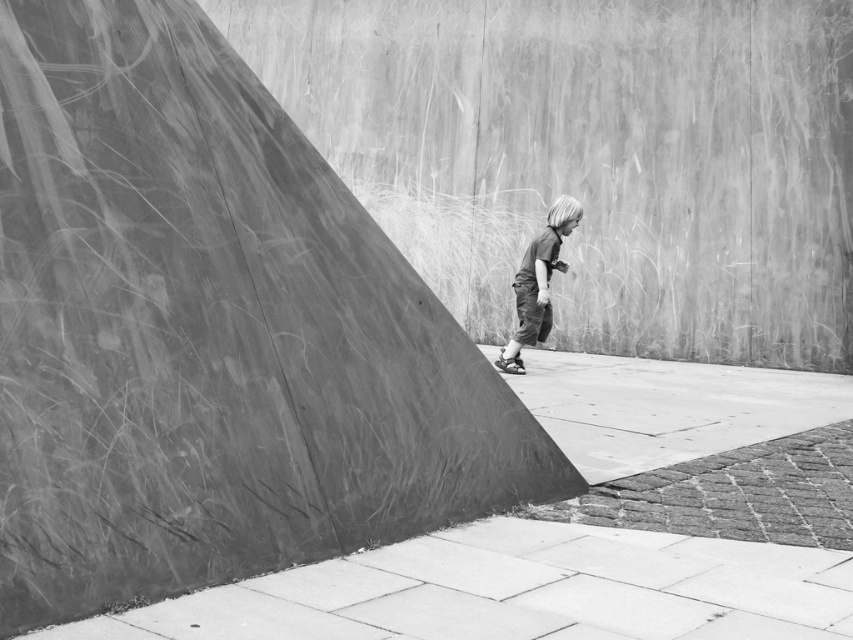
Question: Which point is farther from the camera taking this photo?

Choices:
 (A) (550, 241)
 (B) (561, 624)
 (C) (239, 460)

Answer: (A)

Question: Is smooth concrete ramp at center smaller than dark gray fabric pants at center?

Choices:
 (A) no
 (B) yes

Answer: (A)

Question: Where is smooth concrete ramp at center located in relation to dark gray fabric pants at center in the image?

Choices:
 (A) left
 (B) right

Answer: (A)

Question: Which of these objects is positioned closest to the dark gray fabric pants at center?

Choices:
 (A) smooth concrete pavement at lower center
 (B) smooth concrete ramp at center

Answer: (B)

Question: Can you confirm if smooth concrete ramp at center is positioned to the right of smooth concrete pavement at lower center?

Choices:
 (A) yes
 (B) no

Answer: (B)

Question: Which object is the farthest from the smooth concrete ramp at center?

Choices:
 (A) dark gray fabric pants at center
 (B) smooth concrete pavement at lower center

Answer: (A)